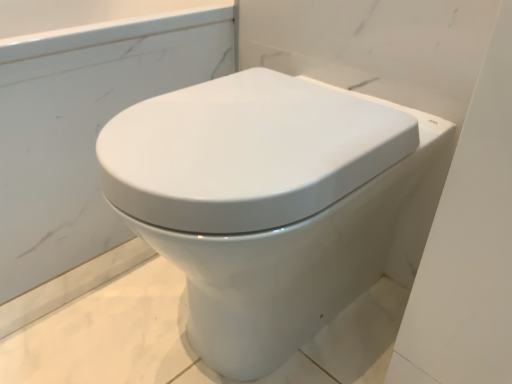
Where is `white glossy toilet at center`? Image resolution: width=512 pixels, height=384 pixels. white glossy toilet at center is located at coordinates [266, 202].

Describe the element at coordinates (266, 202) in the screenshot. I see `white glossy toilet at center` at that location.

I want to click on white glossy toilet at center, so click(266, 202).